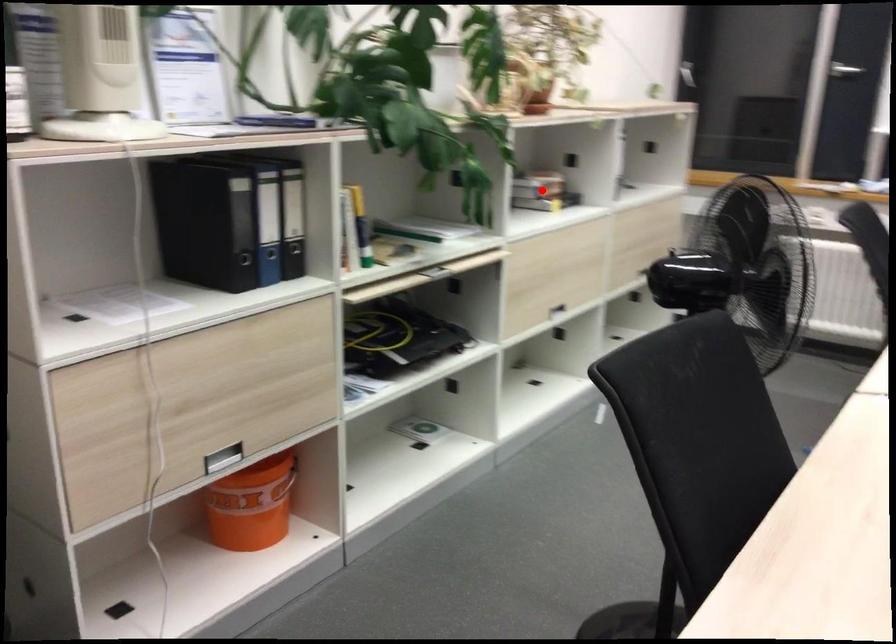
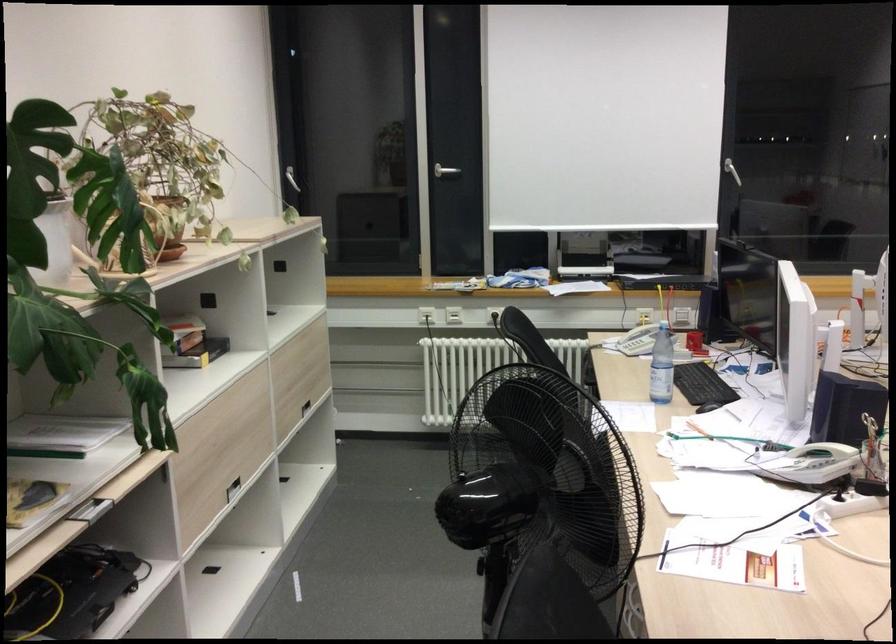
The point at the highlighted location is marked in the first image. Where is the corresponding point in the second image?

(192, 343)